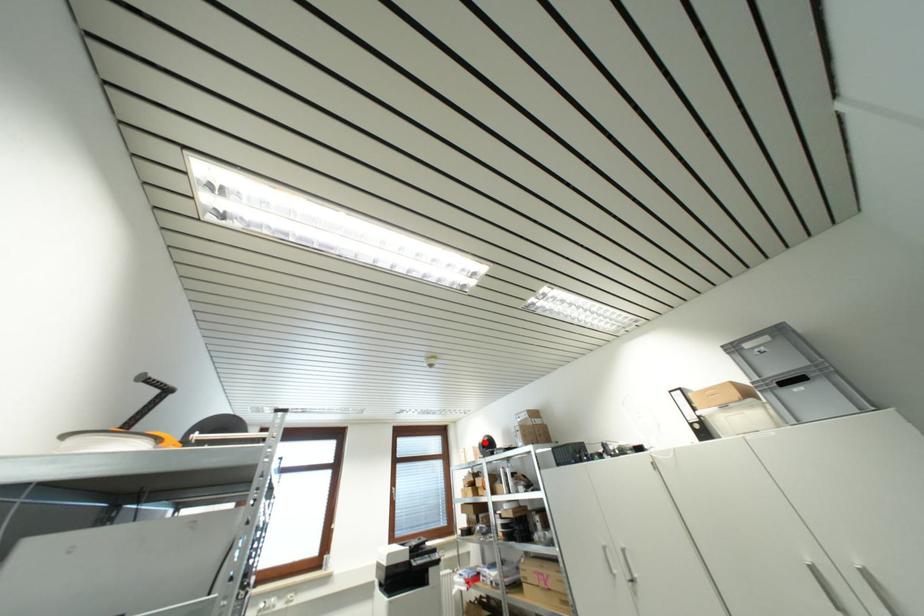
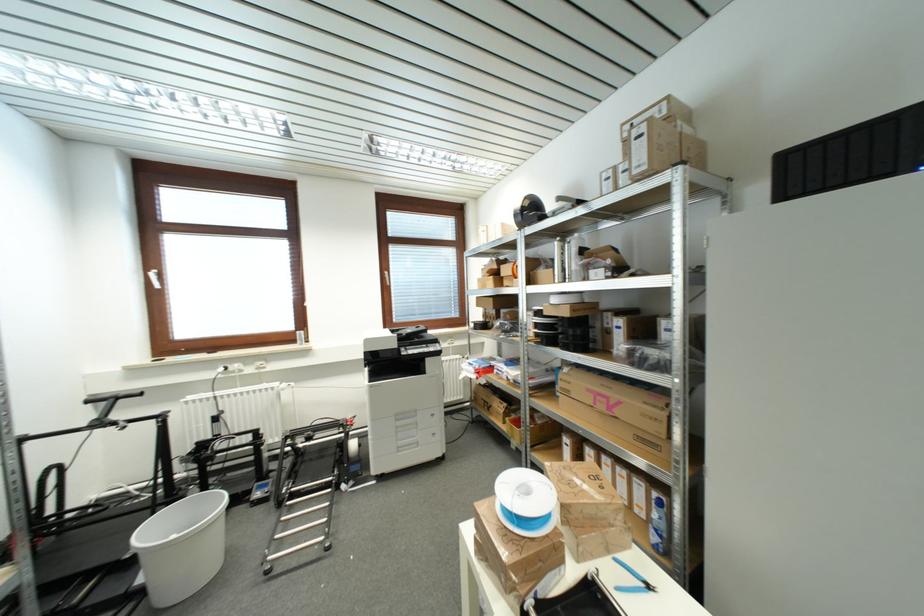
Question: I am providing you with two images of the same scene from different viewpoints. In image1, a red point is highlighted. Considering the same 3D point in image2, which of the following is correct?

Choices:
 (A) It is closer
 (B) It is farther

Answer: (A)